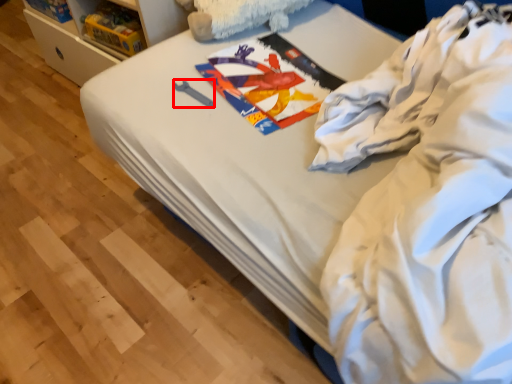
Question: From the image's perspective, what is the correct spatial relationship of equipment (annotated by the red box) in relation to clothing?

Choices:
 (A) below
 (B) above

Answer: (B)